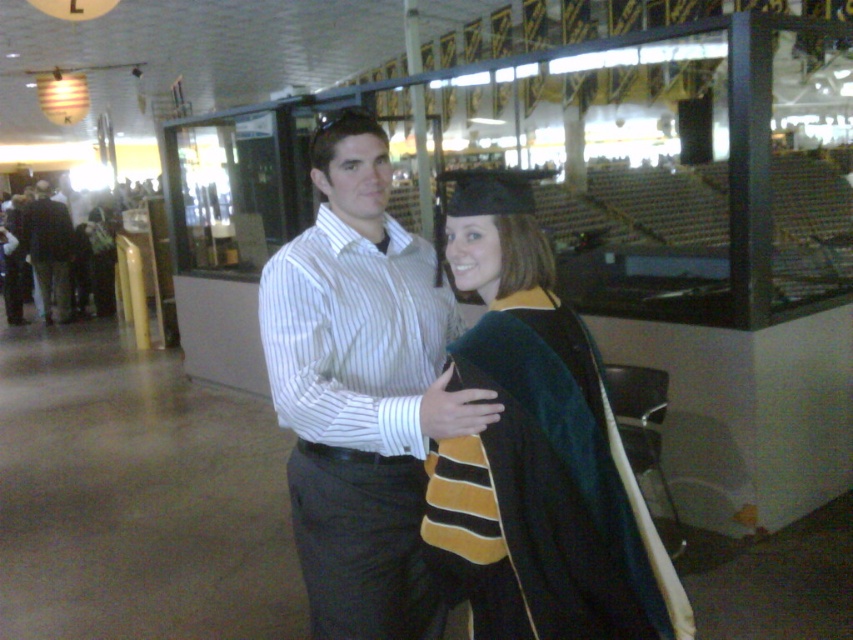
Question: Does velvet black graduation gown at center have a smaller size compared to dark gray pants at left?

Choices:
 (A) no
 (B) yes

Answer: (B)

Question: Estimate the real-world distances between objects in this image. Which object is closer to the velvet black graduation gown at center?

Choices:
 (A) white striped shirt at center
 (B) dark gray pants at left

Answer: (A)

Question: Does velvet black graduation gown at center have a greater width compared to white striped shirt at center?

Choices:
 (A) no
 (B) yes

Answer: (A)

Question: Considering the real-world distances, which object is closest to the dark gray pants at left?

Choices:
 (A) white striped shirt at center
 (B) velvet black graduation gown at center

Answer: (A)

Question: Is velvet black graduation gown at center below dark gray pants at left?

Choices:
 (A) no
 (B) yes

Answer: (B)

Question: Which of the following is the farthest from the observer?

Choices:
 (A) (397, 512)
 (B) (469, 566)

Answer: (A)